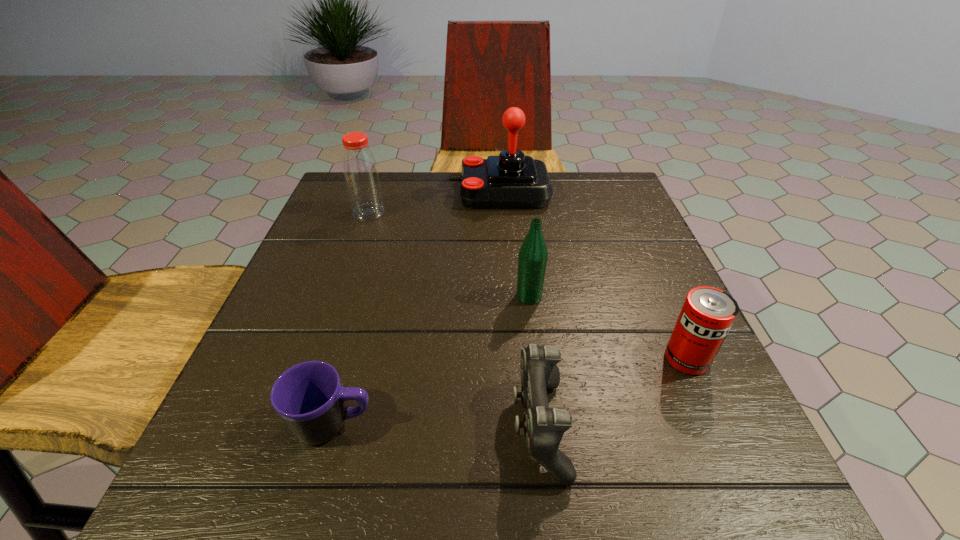
Where is `vacant space at the right edge of the desktop`? vacant space at the right edge of the desktop is located at coordinates (652, 329).

Find the location of `vacant region at the far left corner of the desktop`. vacant region at the far left corner of the desktop is located at coordinates (336, 191).

This screenshot has height=540, width=960. Identify the location of free area in between the farther bottle and the mug. (351, 319).

Locate an element on the screen. The width and height of the screenshot is (960, 540). vacant space that is in between the joystick and the control is located at coordinates click(x=519, y=309).

You are a GUI agent. You are given a task and a screenshot of the screen. Output one action in this format:
    pyautogui.click(x=<x>, y=<y>)
    Task: Click on the blank region between the right bottle and the farther bottle
    
    Given the screenshot: What is the action you would take?
    pyautogui.click(x=449, y=254)

You are a GUI agent. You are given a task and a screenshot of the screen. Output one action in this format:
    pyautogui.click(x=<x>, y=<y>)
    Task: Click on the vacant point located between the rightmost object and the second shortest object
    Image resolution: width=960 pixels, height=540 pixels.
    Given the screenshot: What is the action you would take?
    point(612,393)

The image size is (960, 540). What are the coordinates of `unoccupied position between the right bottle and the joystick` in the screenshot? It's located at (515, 244).

The height and width of the screenshot is (540, 960). In order to click on blank region between the fourth nearest object and the fourth tallest object in this screenshot , I will do `click(608, 328)`.

Find the location of `free space between the shortest object and the nearer bottle`. free space between the shortest object and the nearer bottle is located at coordinates (431, 361).

At what (x,y) coordinates should I click in order to perform the action: click on vacant area that lies between the fourth tallest object and the right bottle. Please return your answer as a coordinate pair (x, y). The width and height of the screenshot is (960, 540). Looking at the image, I should click on (608, 328).